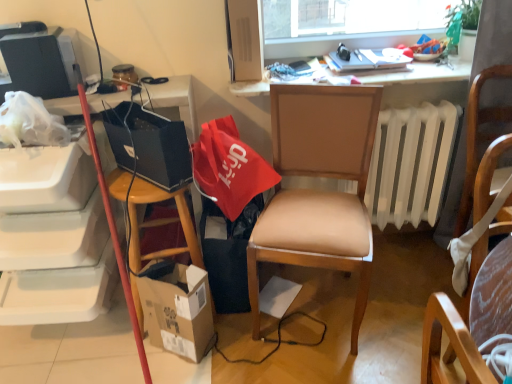
Question: Could you tell me if wooden chair at right, marked as the 2th chair in a left-to-right arrangement, is facing wooden desk at upper center?

Choices:
 (A) yes
 (B) no

Answer: (B)

Question: Can you confirm if wooden chair at right, marked as the 2th chair in a left-to-right arrangement, is bigger than wooden desk at upper center?

Choices:
 (A) no
 (B) yes

Answer: (B)

Question: Does wooden chair at right, marked as the 2th chair in a left-to-right arrangement, appear on the right side of wooden desk at upper center?

Choices:
 (A) no
 (B) yes

Answer: (B)

Question: Is wooden chair at right, marked as the 2th chair in a left-to-right arrangement, with wooden desk at upper center?

Choices:
 (A) yes
 (B) no

Answer: (B)

Question: Is wooden chair at right, marked as the 2th chair in a left-to-right arrangement, completely or partially outside of wooden desk at upper center?

Choices:
 (A) yes
 (B) no

Answer: (A)

Question: Is wooden chair at right, the first chair viewed from the right, smaller than wooden desk at upper center?

Choices:
 (A) yes
 (B) no

Answer: (B)

Question: Is cardboard box at lower left not inside black fabric trash bin/can at lower center?

Choices:
 (A) no
 (B) yes

Answer: (B)

Question: Can you confirm if cardboard box at lower left is wider than black fabric trash bin/can at lower center?

Choices:
 (A) yes
 (B) no

Answer: (B)

Question: From the image's perspective, is cardboard box at lower left located above black fabric trash bin/can at lower center?

Choices:
 (A) yes
 (B) no

Answer: (B)

Question: Considering the relative sizes of cardboard box at lower left and black fabric trash bin/can at lower center in the image provided, is cardboard box at lower left thinner than black fabric trash bin/can at lower center?

Choices:
 (A) no
 (B) yes

Answer: (B)

Question: Considering the relative sizes of cardboard box at lower left and black fabric trash bin/can at lower center in the image provided, is cardboard box at lower left shorter than black fabric trash bin/can at lower center?

Choices:
 (A) no
 (B) yes

Answer: (B)

Question: Is cardboard box at lower left positioned with its back to black fabric trash bin/can at lower center?

Choices:
 (A) no
 (B) yes

Answer: (B)

Question: Does cardboard box at lower left have a greater width compared to red fabric bag at center, arranged as the first handbag when viewed from the right?

Choices:
 (A) no
 (B) yes

Answer: (A)